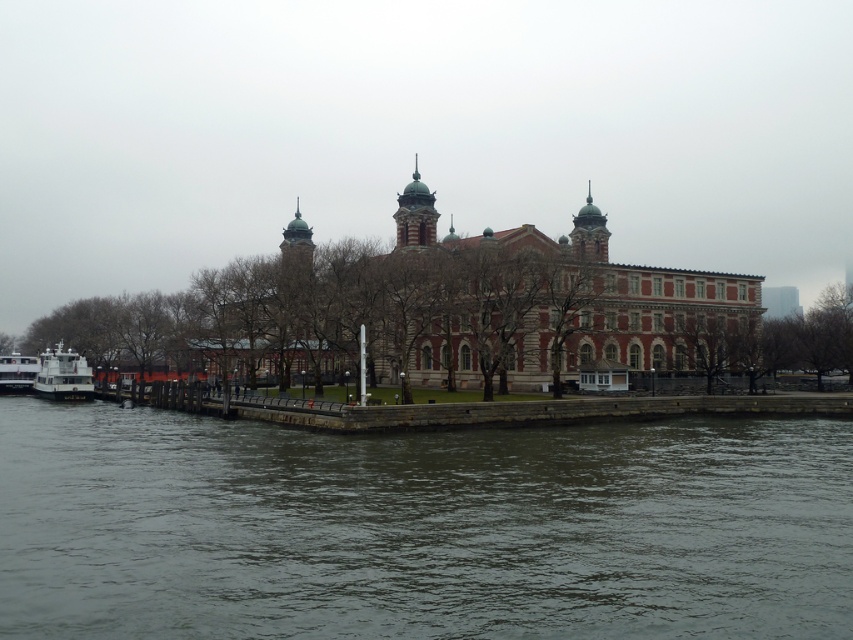
Question: Can you confirm if green copper dome at center is bigger than green stone tower at center?

Choices:
 (A) yes
 (B) no

Answer: (B)

Question: Is white glossy ferry at lower left smaller than green stone tower at center?

Choices:
 (A) no
 (B) yes

Answer: (B)

Question: Which object is closer to the camera taking this photo?

Choices:
 (A) smooth concrete dock at lower center
 (B) green copper dome at center
 (C) white glossy ferry at lower left

Answer: (A)

Question: Based on their relative distances, which object is nearer to the white glossy ferry at lower left?

Choices:
 (A) dark gray water at lower center
 (B) green copper dome at center
 (C) green stone tower at center
 (D) smooth concrete dock at lower center

Answer: (D)

Question: Does dark gray water at lower center have a lesser width compared to green copper dome at center?

Choices:
 (A) yes
 (B) no

Answer: (B)

Question: Which point is closer to the camera taking this photo?

Choices:
 (A) (444, 408)
 (B) (38, 360)
 (C) (68, 400)
 (D) (294, 280)

Answer: (A)